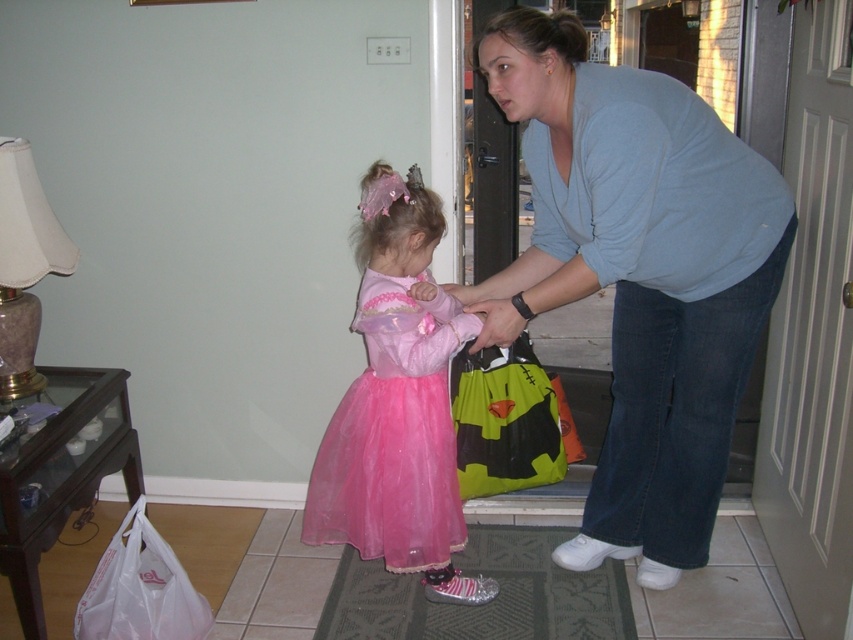
Question: Which point is closer to the camera?

Choices:
 (A) transparent plastic bag at lower left
 (B) pink tulle dress at center
 (C) green textured mat at lower center

Answer: (B)

Question: Which is nearer to the transparent plastic bag at lower left?

Choices:
 (A) pink tulle dress at center
 (B) green fabric bag at center
 (C) light blue shirt at upper right

Answer: (A)

Question: Considering the relative positions of green textured mat at lower center and transparent plastic bag at lower left in the image provided, where is green textured mat at lower center located with respect to transparent plastic bag at lower left?

Choices:
 (A) above
 (B) below

Answer: (B)

Question: Can you confirm if pink tulle dress at center is bigger than green fabric bag at center?

Choices:
 (A) yes
 (B) no

Answer: (A)

Question: Does light blue shirt at upper right appear on the right side of transparent plastic bag at lower left?

Choices:
 (A) yes
 (B) no

Answer: (A)

Question: Among these objects, which one is nearest to the camera?

Choices:
 (A) green fabric bag at center
 (B) light blue shirt at upper right

Answer: (B)